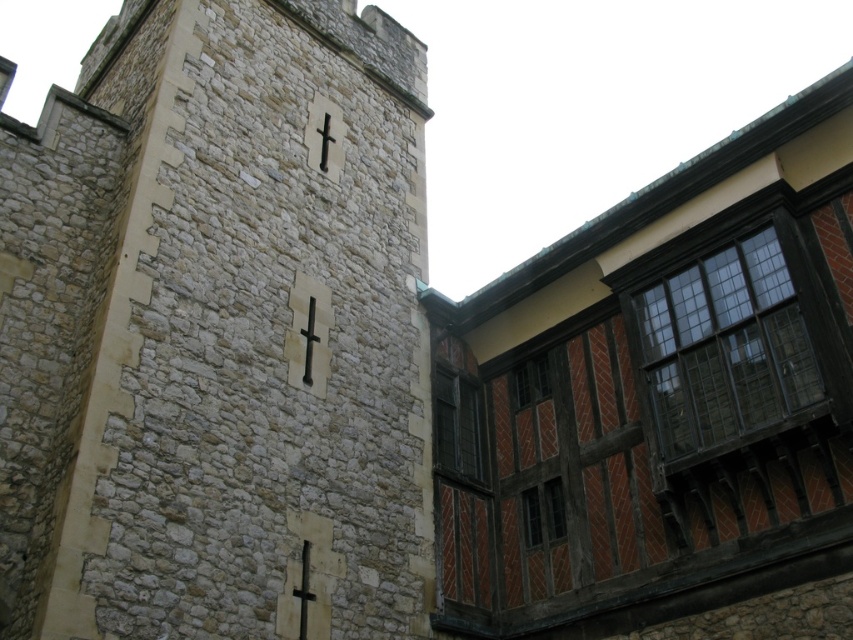
Which is behind, point (460, 451) or point (564, 532)?

The point (460, 451) is behind.

Between matte wooden window at center and wooden-framed window at lower right, which one is positioned lower?

wooden-framed window at lower right

Is point (445, 392) in front of point (553, 480)?

No, (445, 392) is further to viewer.

Find the location of a particular element. matte wooden window at center is located at coordinates (457, 424).

Identify the location of dark wood window at right. (727, 352).

Is dark wood window at right smaller than wooden-framed glass window at center-right?

No.

Is point (703, 365) behind point (537, 358)?

No, (703, 365) is closer to viewer.

At what (x,y) coordinates should I click in order to perform the action: click on dark wood window at right. Please return your answer as a coordinate pair (x, y). Image resolution: width=853 pixels, height=640 pixels. Looking at the image, I should click on (727, 352).

Which is more to the right, matte wooden window at center or wooden-framed glass window at center-right?

A: wooden-framed glass window at center-right is more to the right.

Between point (477, 401) and point (525, 378), which one is positioned behind?

The point (477, 401) is behind.

What are the coordinates of `matte wooden window at center` in the screenshot? It's located at (457, 424).